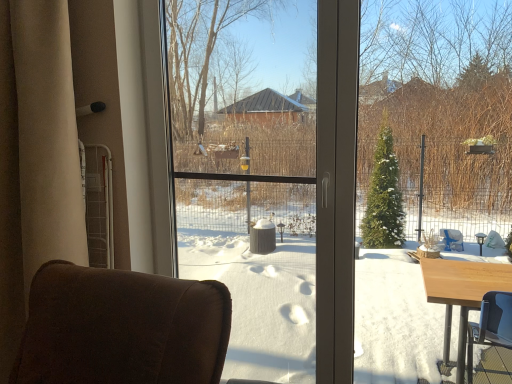
Measure the distance between point [58,177] and camera.

They are 5.28 feet apart.

Identify the location of beige fabric curtain at left. (47, 137).

What do you see at coordinates (47, 137) in the screenshot? The width and height of the screenshot is (512, 384). I see `beige fabric curtain at left` at bounding box center [47, 137].

This screenshot has height=384, width=512. I want to click on beige fabric curtain at left, so click(x=47, y=137).